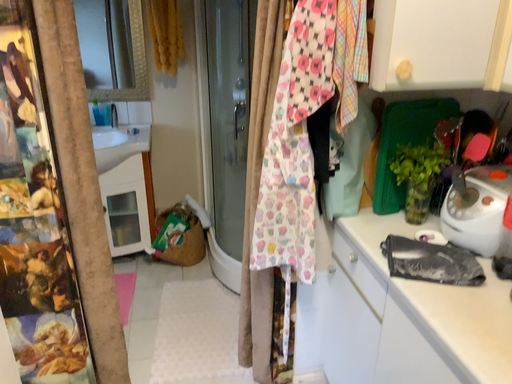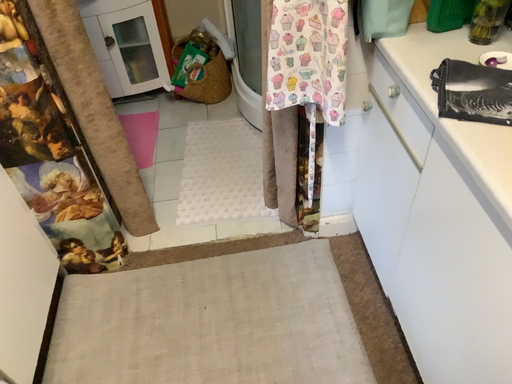
Question: Which way did the camera rotate in the video?

Choices:
 (A) rotated upward
 (B) rotated downward

Answer: (B)